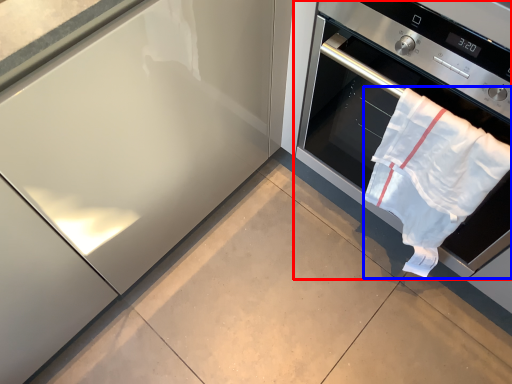
Question: Which object appears farthest to the camera in this image, home appliance (highlighted by a red box) or beach towel (highlighted by a blue box)?

Choices:
 (A) home appliance
 (B) beach towel

Answer: (B)